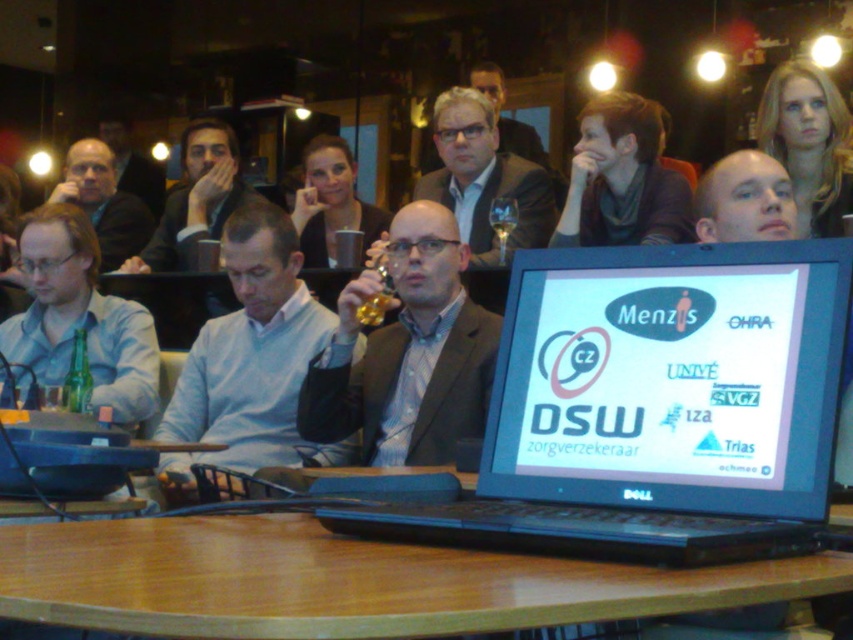
You are standing in the conference room and want to take a closer look at the Dell laptop on the table. The point where you need to reach is located at coordinates point [228,188]. If your arm can extend 1.2 meters, can you reach that point without moving your feet?

The point [228,188] is 5.75 meters away from the camera. Since your arm can only extend 1.2 meters, you cannot reach the point without moving your feet.

You are a photographer trying to capture a closeup of the smooth skin face at center without including the matte gray shirt at upper center in the frame. Based on their positions and sizes, do you think this is possible?

The matte gray shirt at upper center might be wider than the smooth skin face at center, so there is a possibility that the shirt could still be in the frame if they are positioned closely together. Adjust your angle or zoom to ensure only the face is captured.

You are organizing a presentation and need to place a name tag on the table. The name tag is as wide as the dark gray scarf at upper center. Will it fit next to the matte black jacket at upper left if the space available is the same as the jacket?

The dark gray scarf at upper center is wider than the matte black jacket at upper left. Since the name tag matches the scarf width, it will not fit in the space allocated for the jacket.